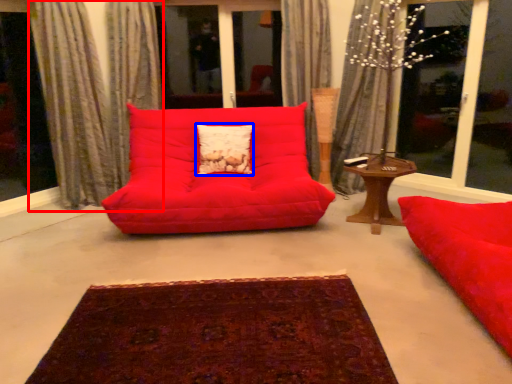
Question: Which of the following is the farthest to the observer, curtain (highlighted by a red box) or pillow (highlighted by a blue box)?

Choices:
 (A) curtain
 (B) pillow

Answer: (B)